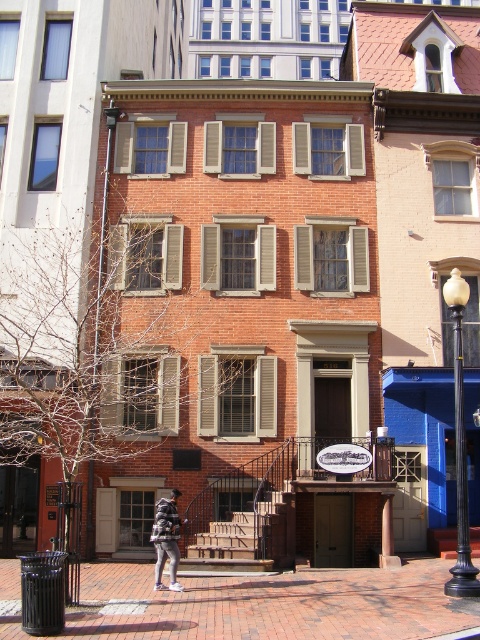
You are a delivery person who needs to park your 2.5 meters tall delivery robot in this area. The robot requires a space that is at least as tall as the brick pavement at center. Can you park the robot next to the white glossy lamp post at right?

The brick pavement at center is not as tall as the white glossy lamp post at right, so the robot can be parked next to the white glossy lamp post at right since it meets the minimum height requirement.

You are a delivery person with a cart that is 3 meters wide. You need to move from the brick pavement at center to the white glossy lamp post at right. Is there enough space between them for your cart to pass through?

The brick pavement at center and white glossy lamp post at right are 5.29 meters apart, so yes, the cart can pass through since the distance between them is greater than the cart width of 3 meters.